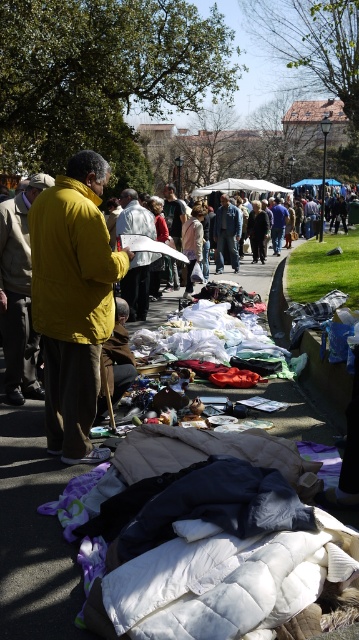
Who is lower down, yellow matte jacket at left or white quilted mattress at center?

white quilted mattress at center

Is point (89, 248) closer to viewer compared to point (34, 404)?

That is True.

This screenshot has width=359, height=640. What are the coordinates of `yellow matte jacket at left` in the screenshot? It's located at (72, 300).